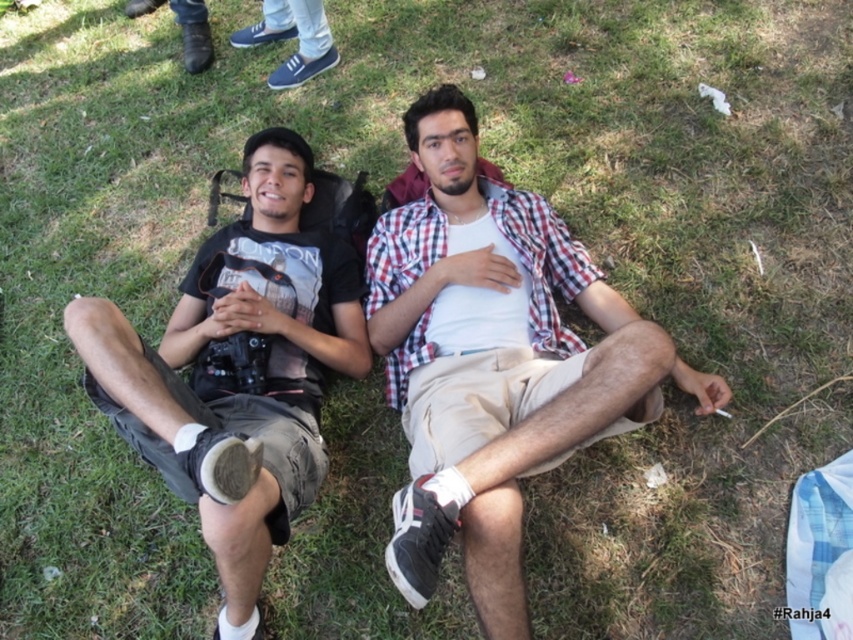
Question: Does checkered fabric shirt at center appear over matte black t-shirt at center?

Choices:
 (A) no
 (B) yes

Answer: (A)

Question: Which of the following is the closest to the observer?

Choices:
 (A) checkered fabric shirt at center
 (B) matte black t-shirt at center

Answer: (B)

Question: Is checkered fabric shirt at center to the left of matte black t-shirt at center from the viewer's perspective?

Choices:
 (A) yes
 (B) no

Answer: (B)

Question: Which object appears closest to the camera in this image?

Choices:
 (A) checkered fabric shirt at center
 (B) matte black t-shirt at center

Answer: (B)

Question: Which point is closer to the camera taking this photo?

Choices:
 (A) (444, 483)
 (B) (349, 272)

Answer: (A)

Question: Is checkered fabric shirt at center further to camera compared to matte black t-shirt at center?

Choices:
 (A) no
 (B) yes

Answer: (B)